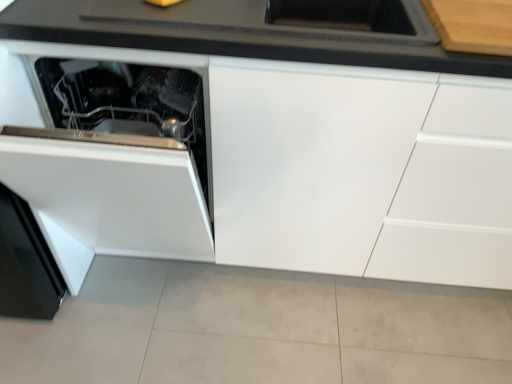
Question: From the image's perspective, is black matte countertop at upper center located above or below white glossy cabinet at center?

Choices:
 (A) below
 (B) above

Answer: (B)

Question: Is black matte countertop at upper center in front of or behind white glossy cabinet at center in the image?

Choices:
 (A) front
 (B) behind

Answer: (B)

Question: Which object is positioned closest to the white glossy cabinet at center?

Choices:
 (A) white glossy oven at lower left
 (B) black matte countertop at upper center

Answer: (A)

Question: Which of these objects is positioned closest to the white glossy cabinet at center?

Choices:
 (A) white glossy oven at lower left
 (B) black matte countertop at upper center

Answer: (A)